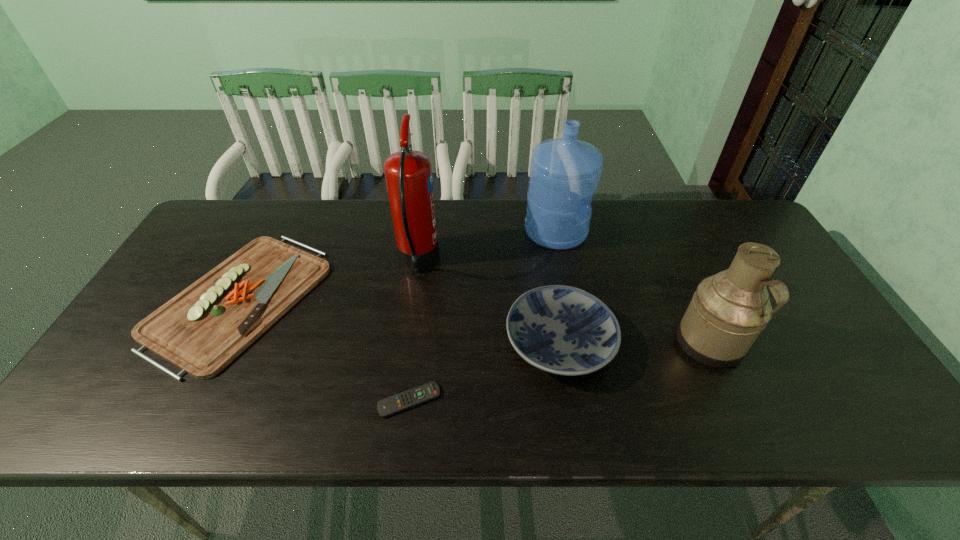
Identify the location of blank region between the remote control and the fire extinguisher. (414, 330).

Locate an element on the screen. This screenshot has width=960, height=540. vacant region between the fourth tallest object and the leftmost object is located at coordinates (399, 321).

Locate which object is the closest to the water jug. Please provide its 2D coordinates. Your answer should be formatted as a tuple, i.e. [(x, y)], where the tuple contains the x and y coordinates of a point satisfying the conditions above.

[(563, 330)]

Locate which object is the fifth closest to the shortest object. Please provide its 2D coordinates. Your answer should be formatted as a tuple, i.e. [(x, y)], where the tuple contains the x and y coordinates of a point satisfying the conditions above.

[(728, 311)]

Locate an element on the screen. Image resolution: width=960 pixels, height=540 pixels. vacant area that satisfies the following two spatial constraints: 1. on the surface of the shortest object; 2. on the left side of the fire extinguisher is located at coordinates (397, 400).

Where is `free location that satisfies the following two spatial constraints: 1. on the surface of the fire extinguisher; 2. on the front side of the chopping board`? Image resolution: width=960 pixels, height=540 pixels. free location that satisfies the following two spatial constraints: 1. on the surface of the fire extinguisher; 2. on the front side of the chopping board is located at coordinates (412, 299).

At what (x,y) coordinates should I click in order to perform the action: click on vacant region that satisfies the following two spatial constraints: 1. on the side of the water jug with the handle; 2. on the left side of the pitcher. Please return your answer as a coordinate pair (x, y). Looking at the image, I should click on click(578, 342).

You are a GUI agent. You are given a task and a screenshot of the screen. Output one action in this format:
    pyautogui.click(x=<x>, y=<y>)
    Task: Click on the free point that satisfies the following two spatial constraints: 1. on the surface of the shortest object; 2. on the right side of the fire extinguisher
    
    Given the screenshot: What is the action you would take?
    pyautogui.click(x=397, y=400)

Identify the location of free space that satisfies the following two spatial constraints: 1. on the surface of the fire extinguisher; 2. on the left side of the pitcher. This screenshot has width=960, height=540. (406, 342).

Image resolution: width=960 pixels, height=540 pixels. In order to click on vacant area that satisfies the following two spatial constraints: 1. on the surface of the fire extinguisher; 2. on the back side of the plate in this screenshot , I will do `click(406, 343)`.